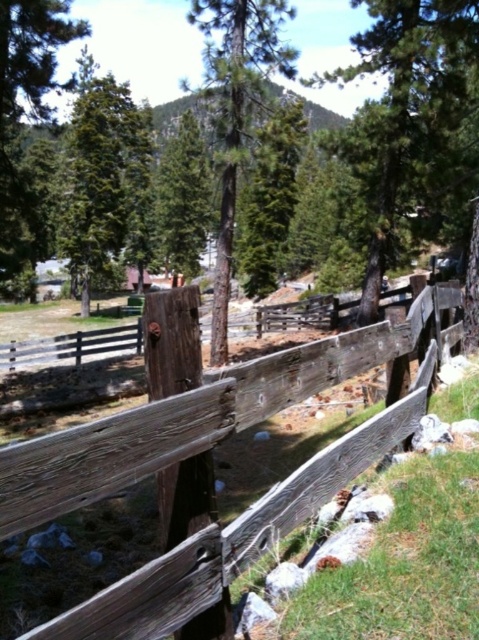
Question: Which of the following is the closest to the observer?

Choices:
 (A) (456, 221)
 (B) (114, 200)
 (C) (162, 186)
 (D) (22, 348)

Answer: (D)

Question: Is the position of smooth brown tree at center less distant than that of white wooden fence at center?

Choices:
 (A) no
 (B) yes

Answer: (B)

Question: Which of the following is the closest to the observer?

Choices:
 (A) (387, 152)
 (B) (189, 220)
 (C) (124, 336)

Answer: (A)

Question: Does weathered wood fence at center have a greater width compared to green textured tree at center?

Choices:
 (A) yes
 (B) no

Answer: (B)

Question: Among these objects, which one is nearest to the camera?

Choices:
 (A) smooth brown tree at center
 (B) green matte tree at upper left
 (C) white wooden fence at center
 (D) green rough bark tree at left

Answer: (D)

Question: Is green rough bark tree at left thinner than white wooden fence at center?

Choices:
 (A) yes
 (B) no

Answer: (B)